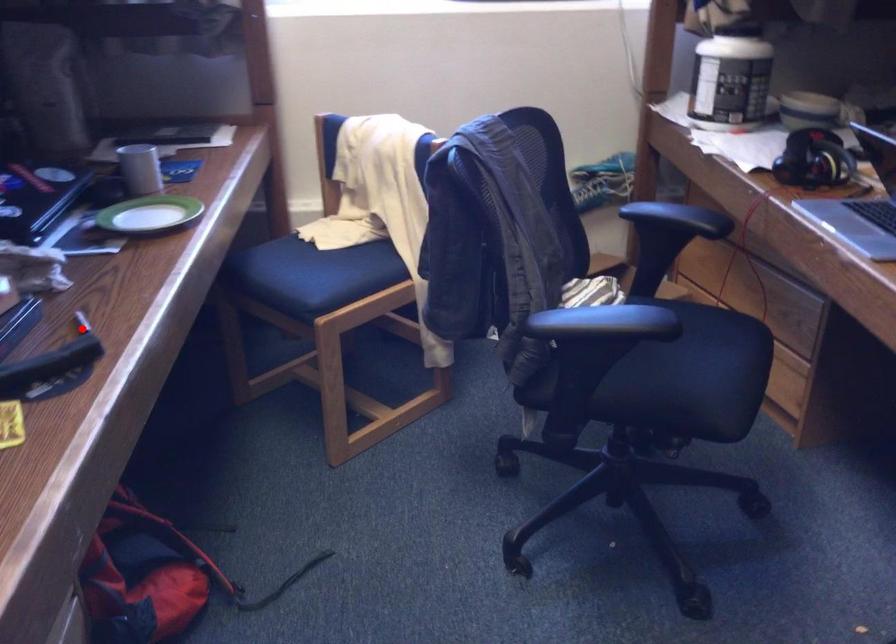
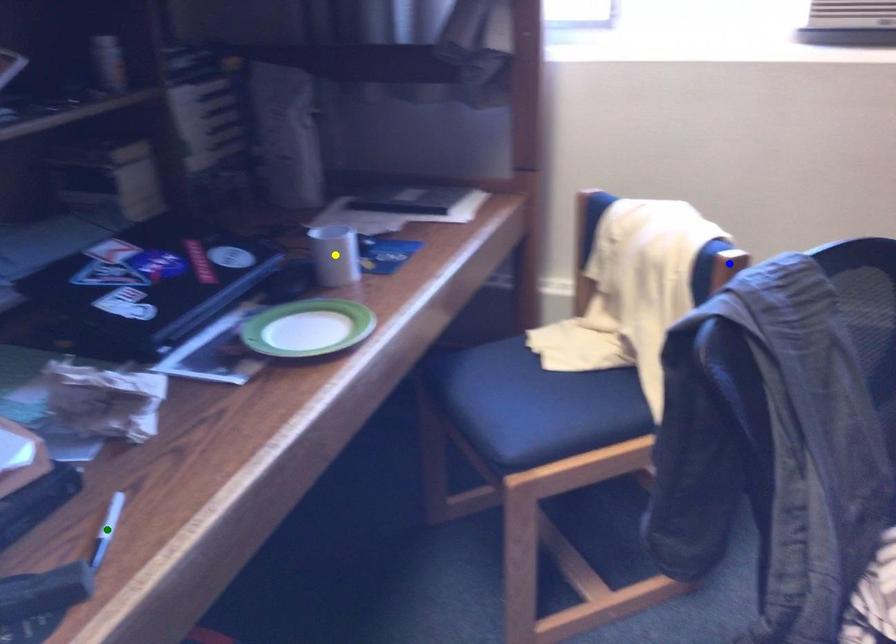
Question: I am providing you with two images of the same scene from different viewpoints. A red point is marked on the first image. You are given multiple points on the second image. Can you choose the point in image 2 that corresponds to the point in image 1?

Choices:
 (A) green point
 (B) blue point
 (C) yellow point

Answer: (A)